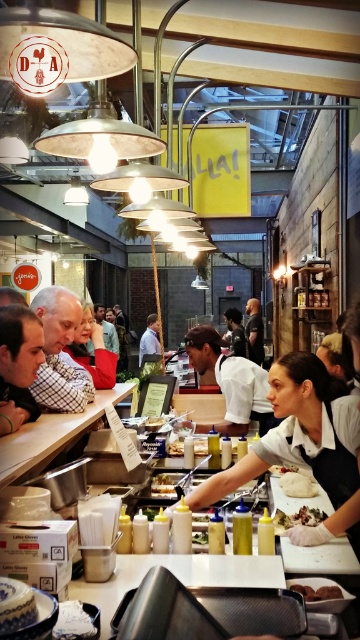
Question: Considering the relative positions of red fleece jacket at center and dark brown leather jacket at center in the image provided, where is red fleece jacket at center located with respect to dark brown leather jacket at center?

Choices:
 (A) left
 (B) right

Answer: (A)

Question: Can you confirm if red fleece jacket at center is positioned to the left of dark brown leather jacket at center?

Choices:
 (A) no
 (B) yes

Answer: (B)

Question: Which point is farther to the camera?

Choices:
 (A) (295, 524)
 (B) (235, 326)

Answer: (B)

Question: Can you confirm if shiny golden bread at center is thinner than brown matte chocolate at center?

Choices:
 (A) no
 (B) yes

Answer: (A)

Question: Estimate the real-world distances between objects in this image. Which object is farther from the white glossy table at lower left?

Choices:
 (A) red fleece jacket at center
 (B) shiny golden bread at center
 (C) brown matte chocolate at center

Answer: (C)

Question: Which object is closer to the camera taking this photo?

Choices:
 (A) brown matte chocolate at center
 (B) shiny golden bread at center
 (C) red fleece jacket at center
 (D) dark brown leather jacket at center

Answer: (A)